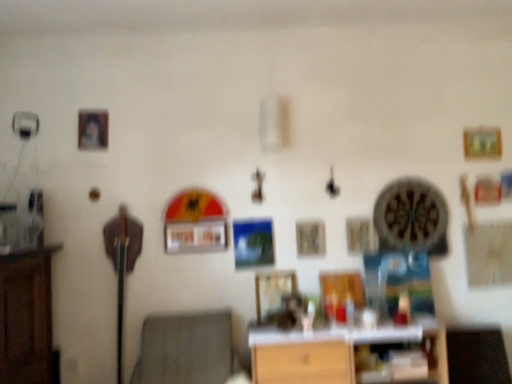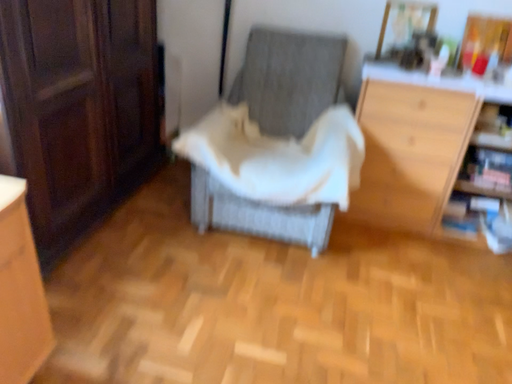
Question: How did the camera likely rotate when shooting the video?

Choices:
 (A) rotated upward
 (B) rotated downward

Answer: (B)